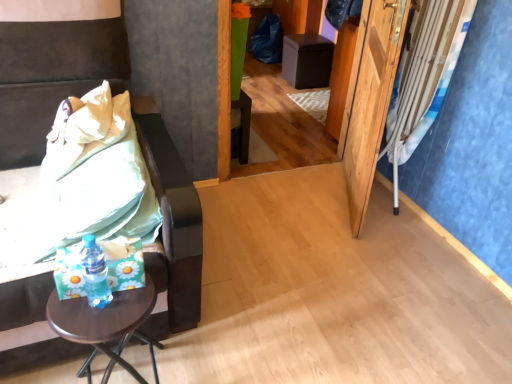
Locate an element on the screen. vacant space situated on the left part of wooden screen door at right is located at coordinates point(288,204).